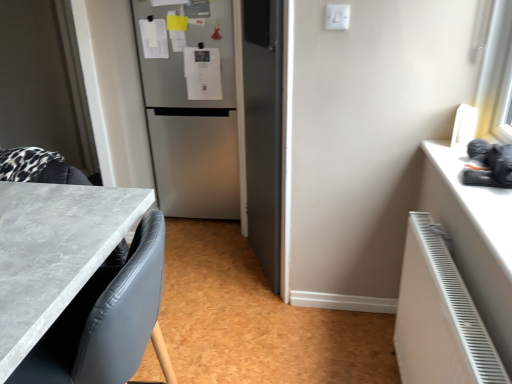
Question: Does white matte radiator at lower right have a smaller size compared to white matte counter top at right?

Choices:
 (A) no
 (B) yes

Answer: (A)

Question: From a real-world perspective, is white matte radiator at lower right positioned over white matte counter top at right based on gravity?

Choices:
 (A) no
 (B) yes

Answer: (A)

Question: Considering the relative sizes of white matte radiator at lower right and white matte counter top at right in the image provided, is white matte radiator at lower right shorter than white matte counter top at right?

Choices:
 (A) yes
 (B) no

Answer: (B)

Question: Is white matte radiator at lower right at the right side of white matte counter top at right?

Choices:
 (A) no
 (B) yes

Answer: (A)

Question: Is white matte radiator at lower right outside of white matte counter top at right?

Choices:
 (A) yes
 (B) no

Answer: (A)

Question: From a real-world perspective, is white matte radiator at lower right positioned under white matte counter top at right based on gravity?

Choices:
 (A) no
 (B) yes

Answer: (B)

Question: Is white matte counter top at right looking in the opposite direction of gray marble countertop at lower left?

Choices:
 (A) no
 (B) yes

Answer: (A)

Question: Is white matte counter top at right facing towards gray marble countertop at lower left?

Choices:
 (A) yes
 (B) no

Answer: (B)

Question: Is white matte counter top at right at the right side of gray marble countertop at lower left?

Choices:
 (A) no
 (B) yes

Answer: (B)

Question: Does white matte counter top at right have a greater width compared to gray marble countertop at lower left?

Choices:
 (A) yes
 (B) no

Answer: (B)

Question: Is white matte counter top at right positioned behind gray marble countertop at lower left?

Choices:
 (A) yes
 (B) no

Answer: (A)

Question: Considering the relative sizes of white matte counter top at right and gray marble countertop at lower left in the image provided, is white matte counter top at right smaller than gray marble countertop at lower left?

Choices:
 (A) no
 (B) yes

Answer: (B)

Question: From a real-world perspective, is stainless steel refrigerator at center on white matte counter top at right?

Choices:
 (A) yes
 (B) no

Answer: (B)